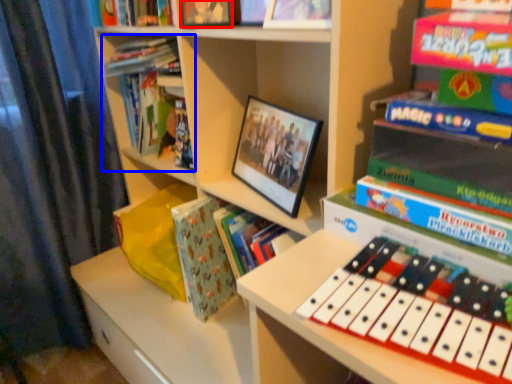
Question: Which point is closer to the camera, book (highlighted by a red box) or book (highlighted by a blue box)?

Choices:
 (A) book
 (B) book

Answer: (A)